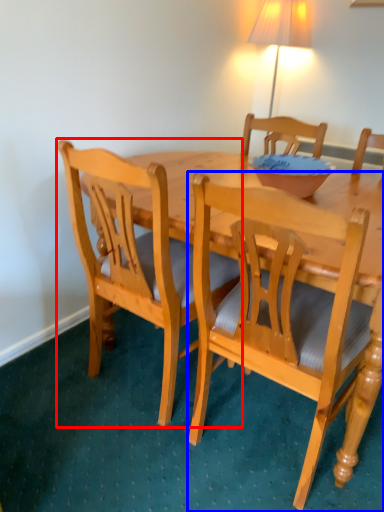
Question: Among these objects, which one is farthest to the camera, chair (highlighted by a red box) or chair (highlighted by a blue box)?

Choices:
 (A) chair
 (B) chair

Answer: (A)